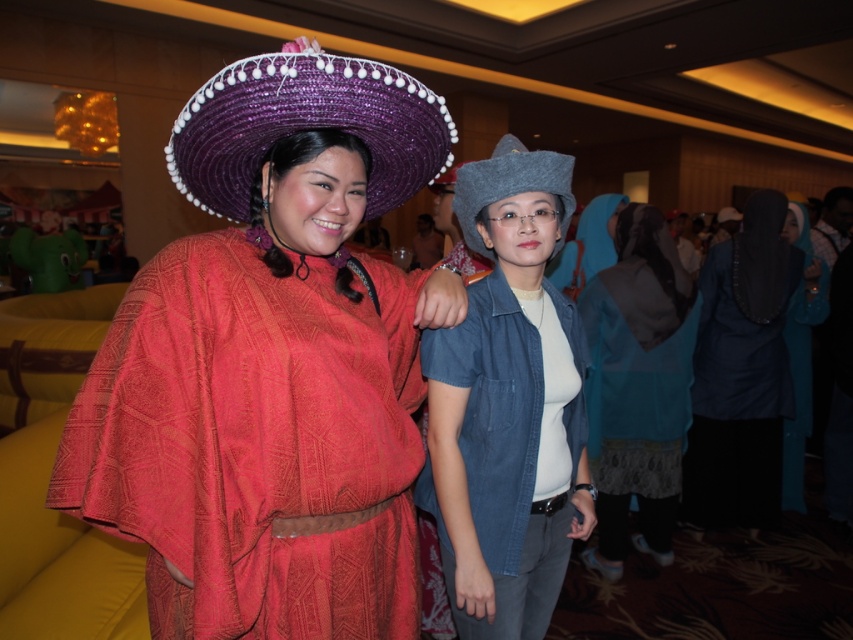
In the scene shown: Is blue textured dress at center bigger than dark blue fabric hijab at right?

No, blue textured dress at center is not bigger than dark blue fabric hijab at right.

Can you confirm if blue textured dress at center is positioned below dark blue fabric hijab at right?

Indeed, blue textured dress at center is positioned under dark blue fabric hijab at right.

Is point (611, 476) behind point (747, 483)?

No, it is not.

The width and height of the screenshot is (853, 640). Find the location of `blue textured dress at center`. blue textured dress at center is located at coordinates 637,387.

Who is more distant from viewer, [657,284] or [804,260]?

The point [804,260] is behind.

Does point (677, 490) come closer to viewer compared to point (807, 307)?

Yes, point (677, 490) is closer to viewer.

What are the coordinates of `blue textured dress at center` in the screenshot? It's located at (637, 387).

In order to click on blue textured dress at center in this screenshot , I will do `click(637, 387)`.

Who is positioned more to the right, blue textured dress at center or purple straw sombrero at upper left?

From the viewer's perspective, blue textured dress at center appears more on the right side.

Where is `blue textured dress at center`? blue textured dress at center is located at coordinates (637, 387).